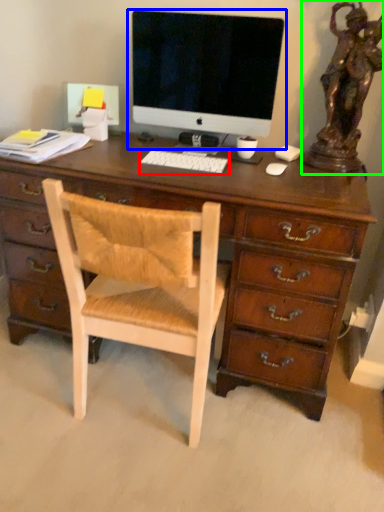
Question: Based on their relative distances, which object is farther from computer keyboard (highlighted by a red box)? Choose from computer monitor (highlighted by a blue box) and bronze statue (highlighted by a green box).

Choices:
 (A) computer monitor
 (B) bronze statue

Answer: (B)